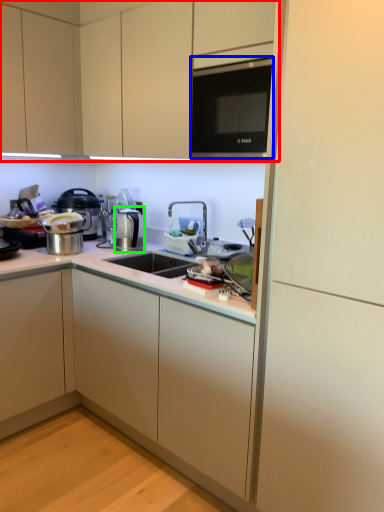
Question: Estimate the real-world distances between objects in this image. Which object is farther from cabinetry (highlighted by a red box), microwave (highlighted by a blue box) or coffee machine (highlighted by a green box)?

Choices:
 (A) microwave
 (B) coffee machine

Answer: (B)